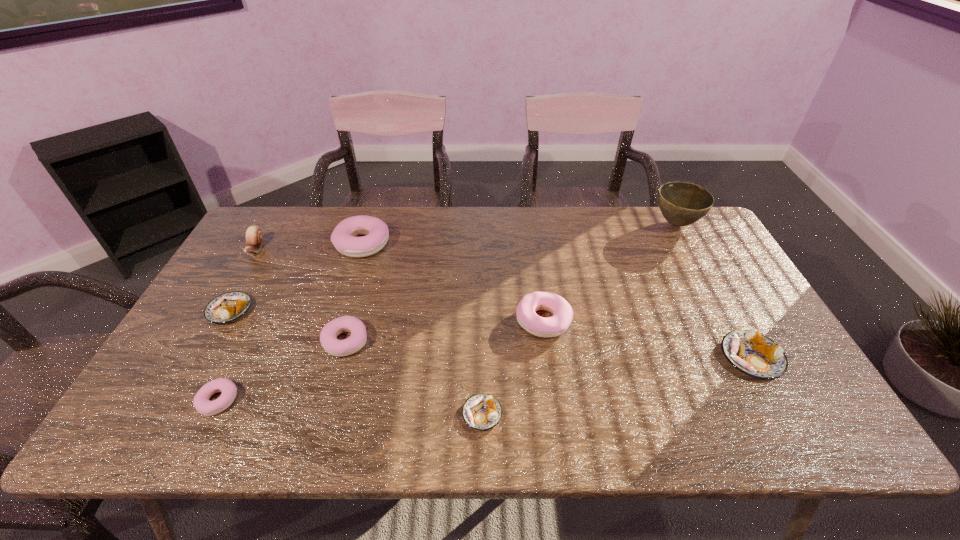
Where is `object that is the seventh closest one to the bowl`? object that is the seventh closest one to the bowl is located at coordinates (202, 404).

The image size is (960, 540). In order to click on pastry object that ranks as the closest to the biggest brown pastry in this screenshot , I will do pyautogui.click(x=562, y=312).

Find the location of a particular element. the third closest pastry relative to the third biggest pink pastry is located at coordinates point(343,237).

Where is `pink pastry that is the fourth closest to the escargot`? pink pastry that is the fourth closest to the escargot is located at coordinates click(x=562, y=312).

The image size is (960, 540). I want to click on pink pastry that is the closest to the bowl, so click(x=562, y=312).

This screenshot has height=540, width=960. In order to click on the third closest brown pastry relative to the third smallest pink pastry in this screenshot , I will do `click(227, 307)`.

Identify which brown pastry is the second closest to the smallest pink pastry. Please provide its 2D coordinates. Your answer should be formatted as a tuple, i.e. [(x, y)], where the tuple contains the x and y coordinates of a point satisfying the conditions above.

[(481, 411)]

Where is `free spot that satisfies the following two spatial constraints: 1. on the back side of the nearest pink pastry; 2. on the right side of the second farthest brown pastry`? free spot that satisfies the following two spatial constraints: 1. on the back side of the nearest pink pastry; 2. on the right side of the second farthest brown pastry is located at coordinates (240, 357).

Identify the location of free spot that satisfies the following two spatial constraints: 1. on the front-facing side of the escargot; 2. on the right side of the sixth object from left to right. (159, 414).

I want to click on vacant space that satisfies the following two spatial constraints: 1. on the front-facing side of the escargot; 2. on the right side of the leftmost pink pastry, so click(x=167, y=400).